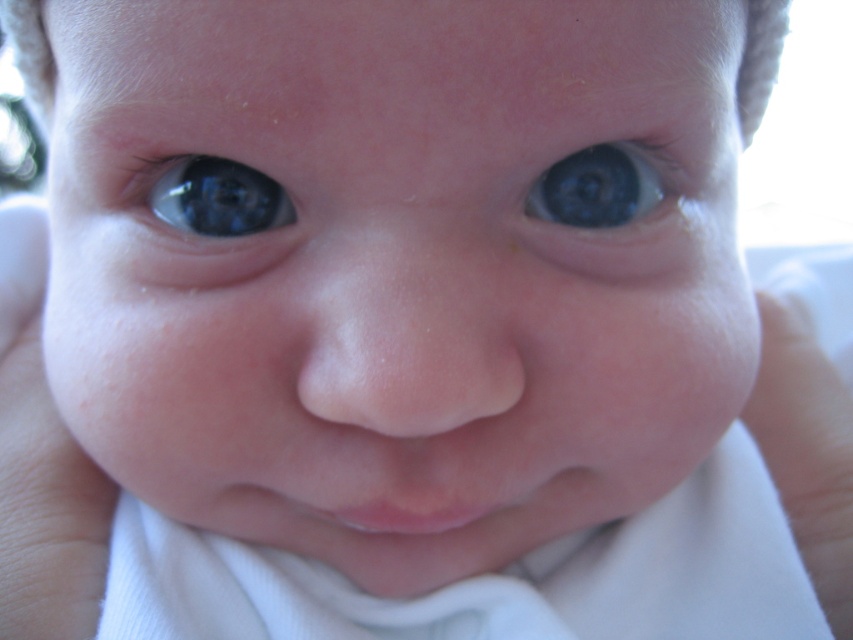
Question: Does white soft skin at lower left lie behind blue glossy eye at upper left?

Choices:
 (A) no
 (B) yes

Answer: (B)

Question: Among these points, which one is nearest to the camera?

Choices:
 (A) (827, 595)
 (B) (279, 218)
 (C) (61, 422)

Answer: (B)

Question: Which of the following is the closest to the observer?

Choices:
 (A) (648, 179)
 (B) (764, 339)
 (C) (276, 216)

Answer: (C)

Question: Does white soft skin at lower left appear over white fabric at lower right?

Choices:
 (A) yes
 (B) no

Answer: (A)

Question: Which point is closer to the camera taking this photo?

Choices:
 (A) (787, 506)
 (B) (231, 168)
 (C) (613, 211)

Answer: (B)

Question: From the image, what is the correct spatial relationship of white soft skin at lower left in relation to white fabric at lower right?

Choices:
 (A) below
 (B) above

Answer: (B)